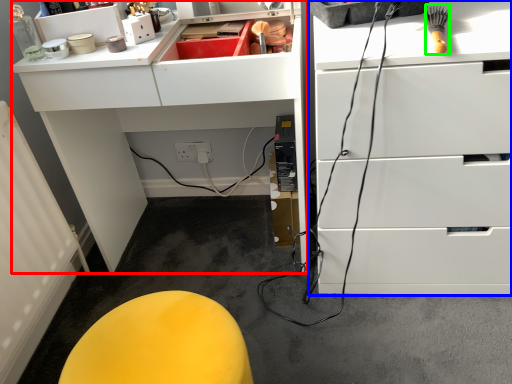
Question: Which is nearer to the computer desk (highlighted by a red box)? chest of drawers (highlighted by a blue box) or brush (highlighted by a green box).

Choices:
 (A) chest of drawers
 (B) brush

Answer: (A)